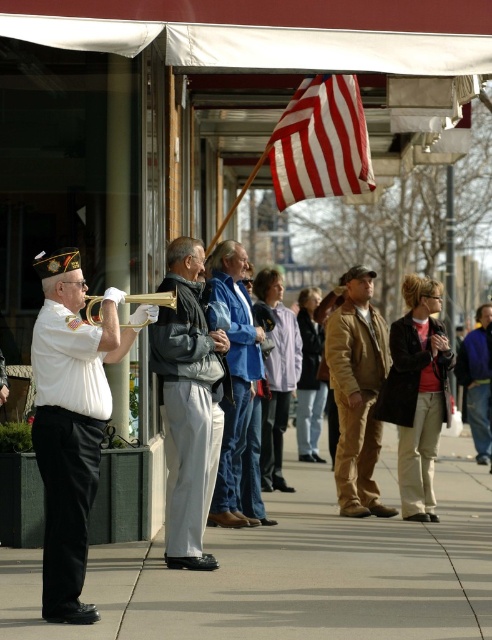
You are standing at the point labeled as point [291,572] in the image. Looking around, what type of surface are you currently standing on?

The point [291,572] corresponds to the gray concrete sidewalk at center, so you are standing on a gray concrete sidewalk.